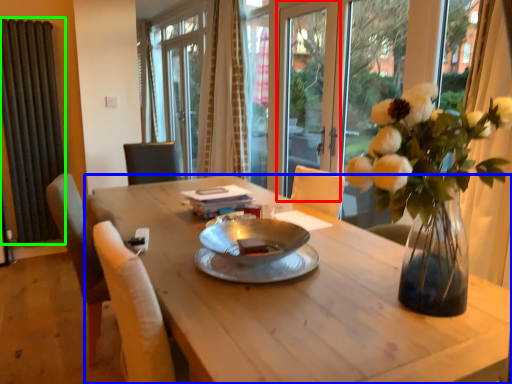
Question: Which is nearer to the screen door (highlighted by a red box)? desk (highlighted by a blue box) or radiator (highlighted by a green box).

Choices:
 (A) desk
 (B) radiator

Answer: (A)